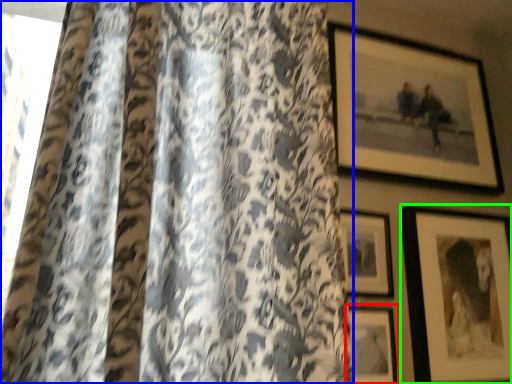
Question: Based on their relative distances, which object is nearer to picture frame (highlighted by a red box)? Choose from curtain (highlighted by a blue box) and picture frame (highlighted by a green box).

Choices:
 (A) curtain
 (B) picture frame

Answer: (B)